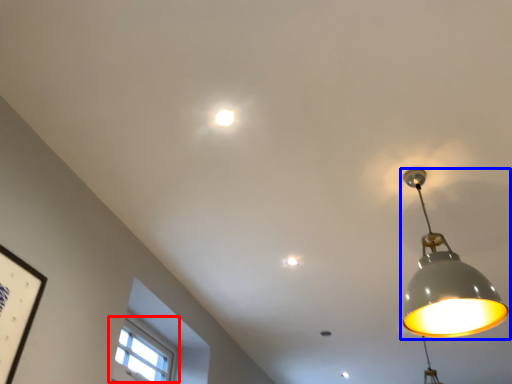
Question: Which object is closer to the camera taking this photo, window (highlighted by a red box) or lamp (highlighted by a blue box)?

Choices:
 (A) window
 (B) lamp

Answer: (B)